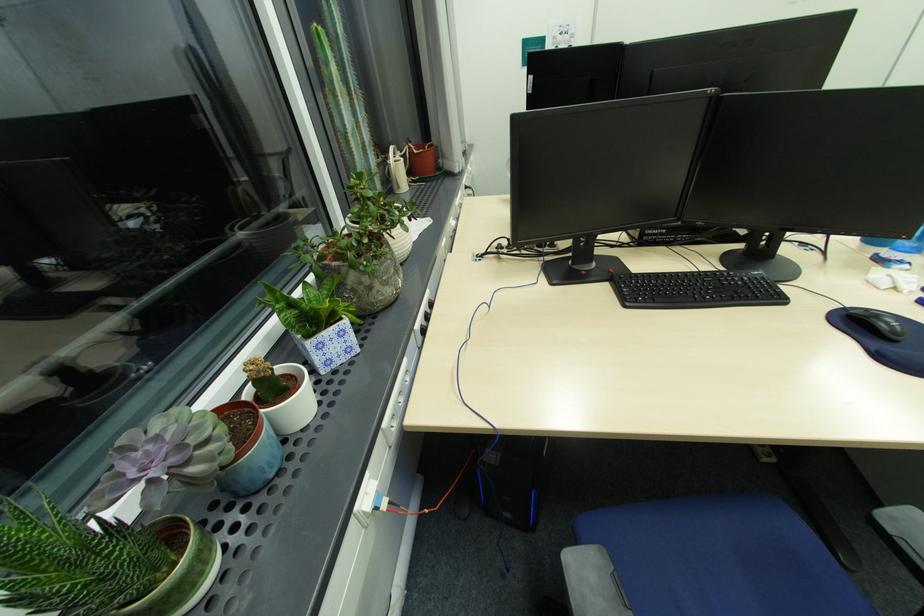
The width and height of the screenshot is (924, 616). In order to click on mouse scroll wheel in this screenshot , I will do `click(872, 315)`.